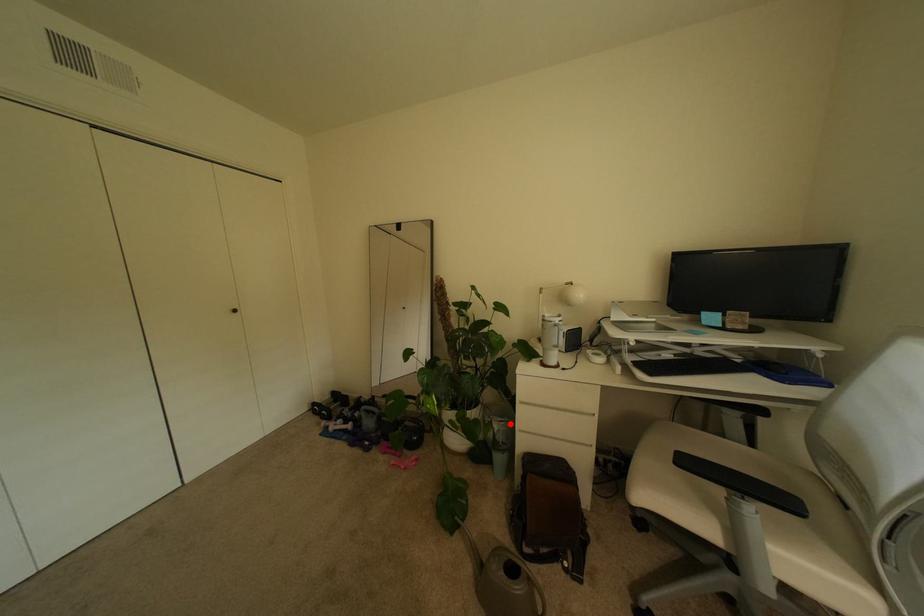
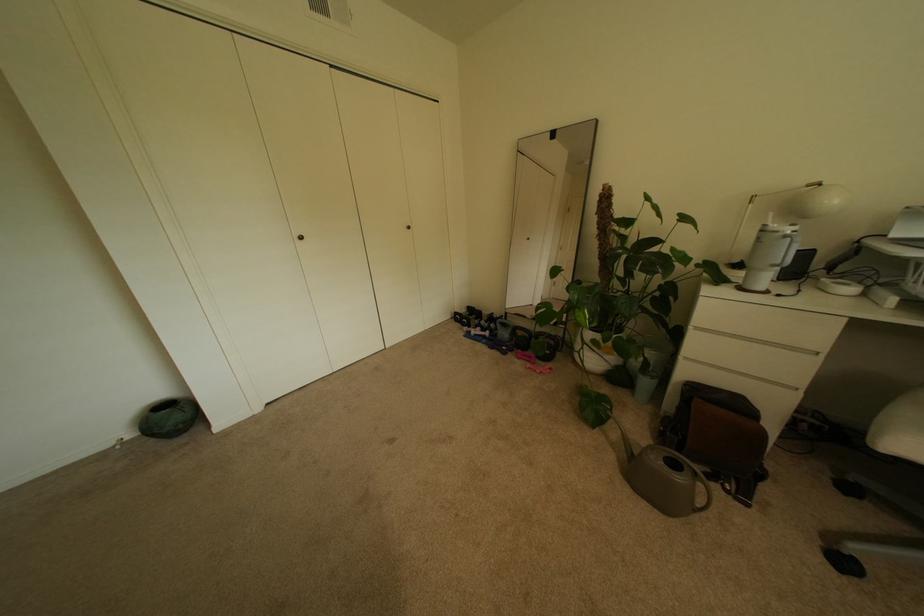
Find the pixel in the second image that matches the highlighted location in the first image.

(661, 353)